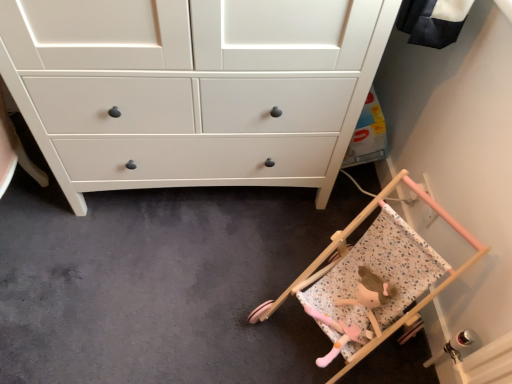
Question: Should I look upward or downward to see wooden baby carriage at lower right?

Choices:
 (A) down
 (B) up

Answer: (A)

Question: From a real-world perspective, does wooden baby carriage at lower right stand above fluffy pink doll at lower right?

Choices:
 (A) no
 (B) yes

Answer: (B)

Question: Considering the relative sizes of wooden baby carriage at lower right and fluffy pink doll at lower right in the image provided, is wooden baby carriage at lower right shorter than fluffy pink doll at lower right?

Choices:
 (A) no
 (B) yes

Answer: (A)

Question: Can you confirm if wooden baby carriage at lower right is positioned to the left of fluffy pink doll at lower right?

Choices:
 (A) no
 (B) yes

Answer: (B)

Question: Considering the relative positions of wooden baby carriage at lower right and fluffy pink doll at lower right in the image provided, is wooden baby carriage at lower right to the right of fluffy pink doll at lower right from the viewer's perspective?

Choices:
 (A) yes
 (B) no

Answer: (B)

Question: From the image's perspective, is wooden baby carriage at lower right on fluffy pink doll at lower right?

Choices:
 (A) yes
 (B) no

Answer: (A)

Question: Is wooden baby carriage at lower right not near fluffy pink doll at lower right?

Choices:
 (A) yes
 (B) no

Answer: (B)

Question: From the image's perspective, is fluffy pink doll at lower right beneath wooden baby carriage at lower right?

Choices:
 (A) yes
 (B) no

Answer: (A)

Question: Are fluffy pink doll at lower right and wooden baby carriage at lower right beside each other?

Choices:
 (A) no
 (B) yes

Answer: (B)

Question: Considering the relative positions of fluffy pink doll at lower right and wooden baby carriage at lower right in the image provided, is fluffy pink doll at lower right in front of wooden baby carriage at lower right?

Choices:
 (A) no
 (B) yes

Answer: (A)

Question: Is fluffy pink doll at lower right facing towards wooden baby carriage at lower right?

Choices:
 (A) yes
 (B) no

Answer: (A)

Question: Does fluffy pink doll at lower right come behind wooden baby carriage at lower right?

Choices:
 (A) yes
 (B) no

Answer: (A)

Question: Does fluffy pink doll at lower right have a lesser width compared to wooden baby carriage at lower right?

Choices:
 (A) yes
 (B) no

Answer: (A)

Question: In terms of height, does fluffy pink doll at lower right look taller or shorter compared to wooden baby carriage at lower right?

Choices:
 (A) short
 (B) tall

Answer: (A)